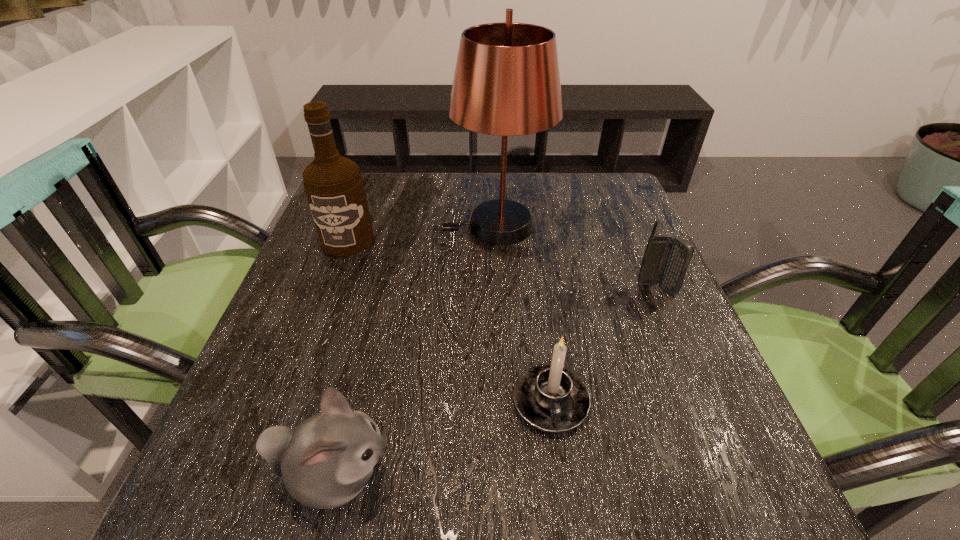
This screenshot has width=960, height=540. What are the coordinates of `vacant space that satisfies the following two spatial constraints: 1. with a handle on the side of the candle holder; 2. on the face of the hamster` in the screenshot? It's located at (561, 475).